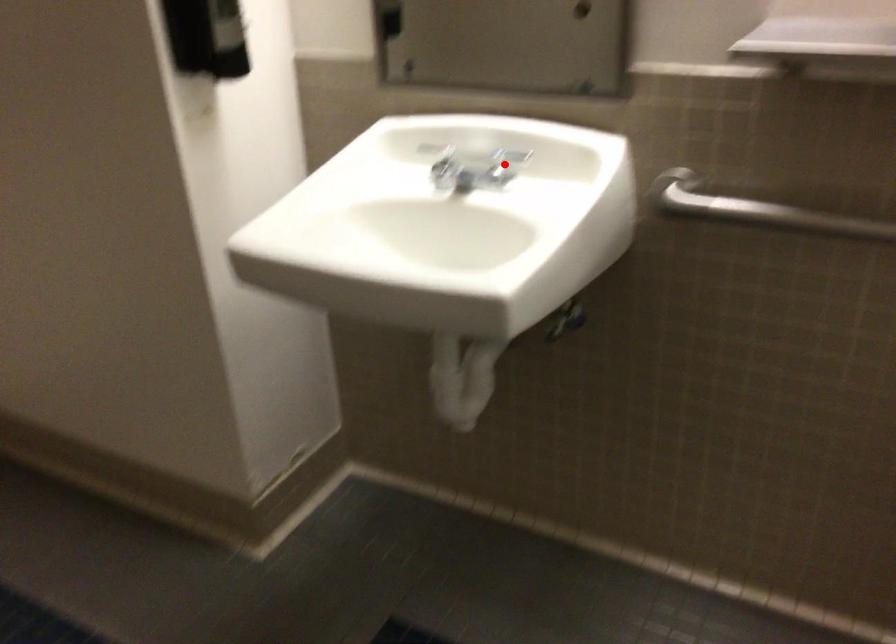
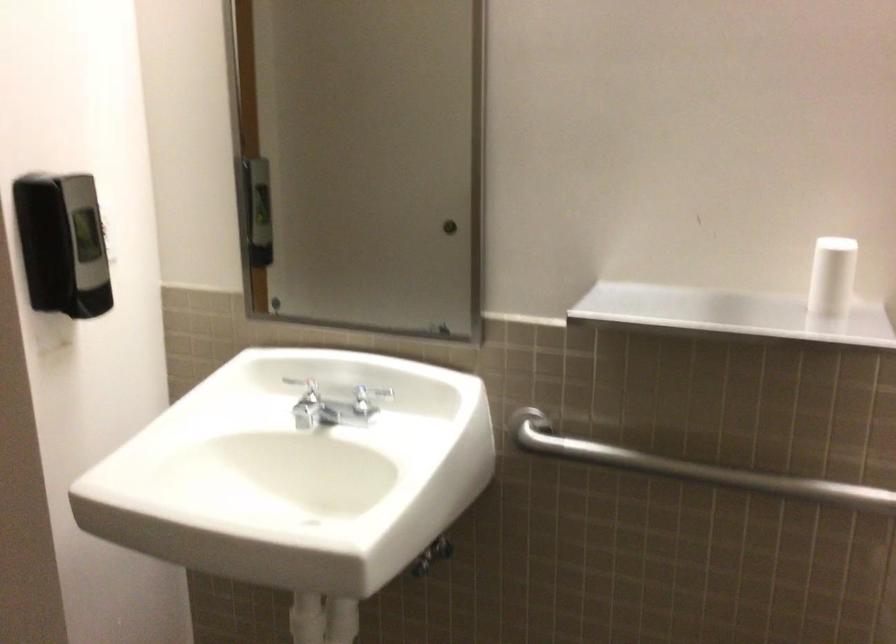
In the second image, find the point that corresponds to the highlighted location in the first image.

(368, 397)